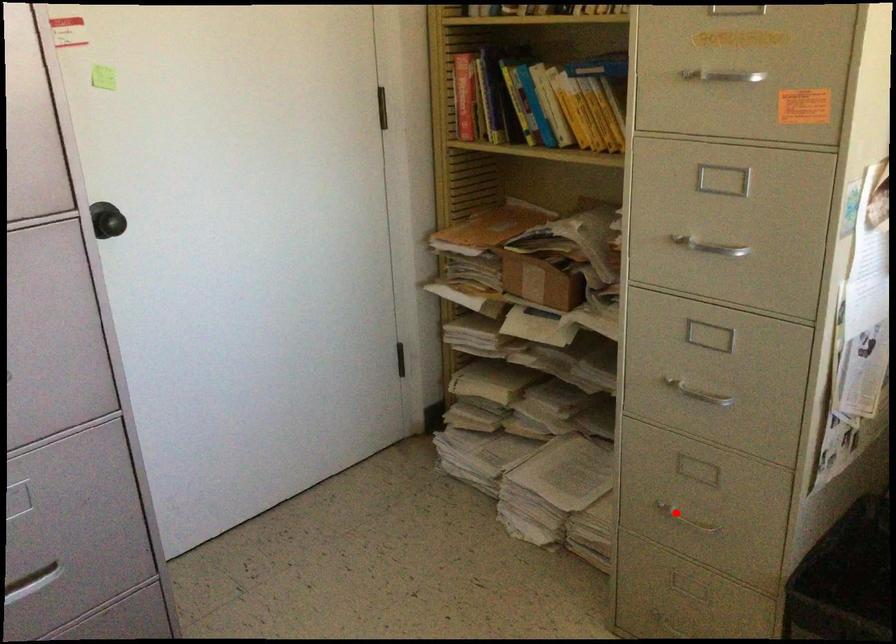
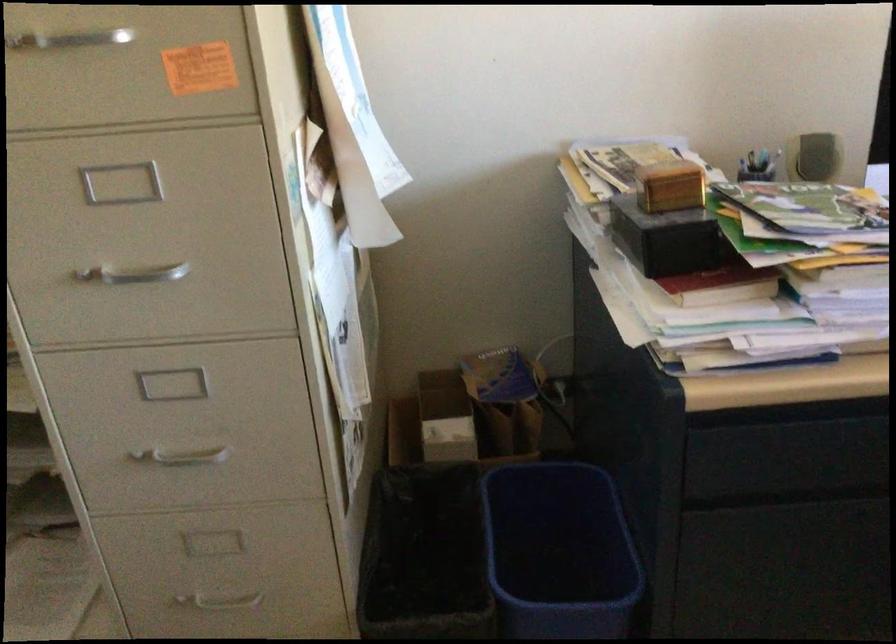
Question: I am providing you with two images of the same scene from different viewpoints. In image1, a red point is highlighted. Considering the same 3D point in image2, which of the following is correct?

Choices:
 (A) It is closer
 (B) It is farther

Answer: (A)